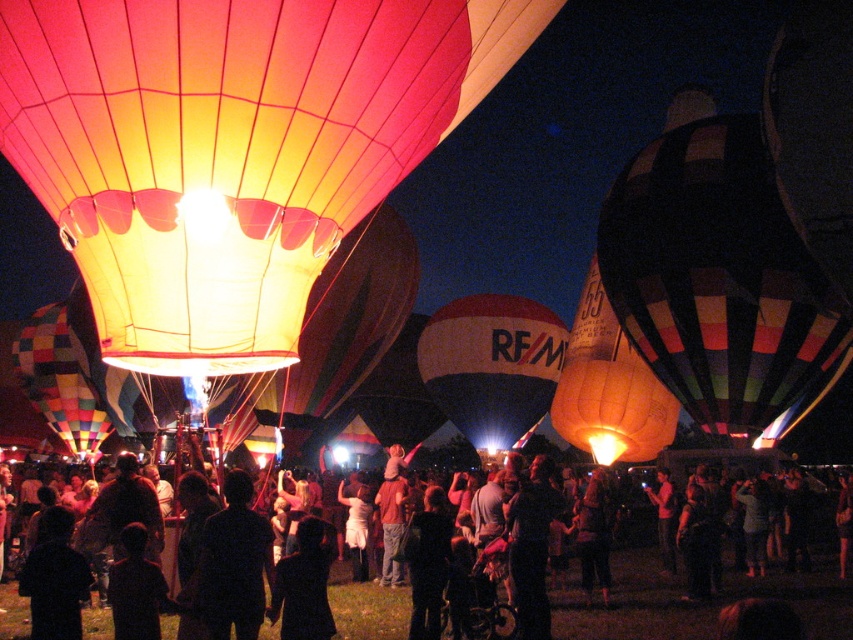
Who is positioned more to the right, multicolored striped fabric hot air balloon at right or dark fabric coat at center?

From the viewer's perspective, multicolored striped fabric hot air balloon at right appears more on the right side.

Between point (834, 356) and point (281, 605), which one is positioned in front?

Point (281, 605) is more forward.

Locate an element on the screen. Image resolution: width=853 pixels, height=640 pixels. multicolored striped fabric hot air balloon at right is located at coordinates 718,276.

Is multicolored striped fabric hot air balloon at right taller than white and red striped balloon at center?

Yes.

Can you confirm if multicolored striped fabric hot air balloon at right is positioned below white and red striped balloon at center?

No.

Find the location of a particular element. The image size is (853, 640). multicolored striped fabric hot air balloon at right is located at coordinates (718, 276).

At what (x,y) coordinates should I click in order to perform the action: click on multicolored striped fabric hot air balloon at right. Please return your answer as a coordinate pair (x, y). Looking at the image, I should click on (718, 276).

Can you confirm if matte black crowd at center is wider than white and red striped balloon at center?

Indeed, matte black crowd at center has a greater width compared to white and red striped balloon at center.

Between matte black crowd at center and white and red striped balloon at center, which one has less height?

Standing shorter between the two is matte black crowd at center.

Who is more distant from viewer, [99,627] or [479,324]?

The point [479,324] is behind.

Identify the location of matte black crowd at center. The width and height of the screenshot is (853, 640). (695, 602).